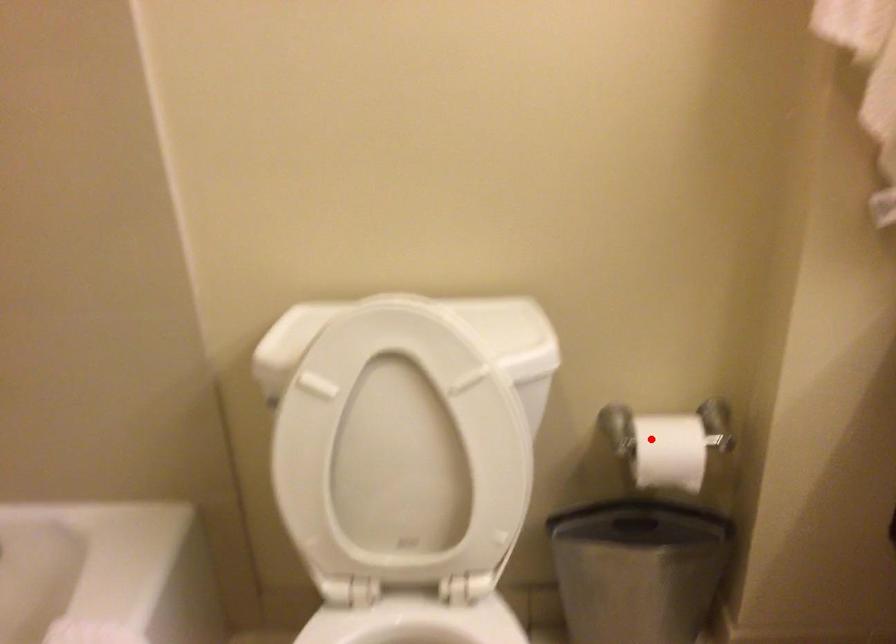
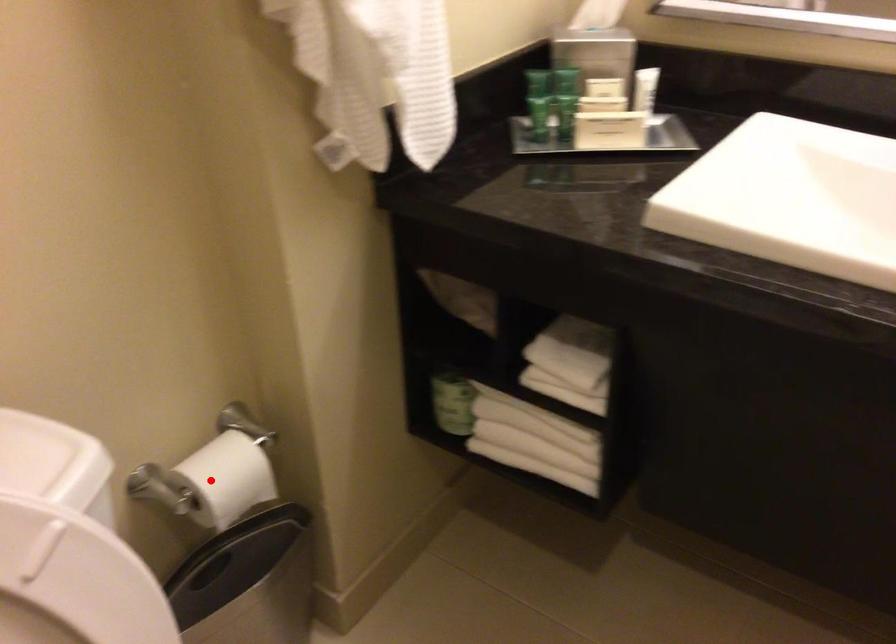
I am providing you with two images of the same scene from different viewpoints. A red point is marked on the first image and another point is marked on the second image. Is the marked point in image1 the same physical position as the marked point in image2?

Yes